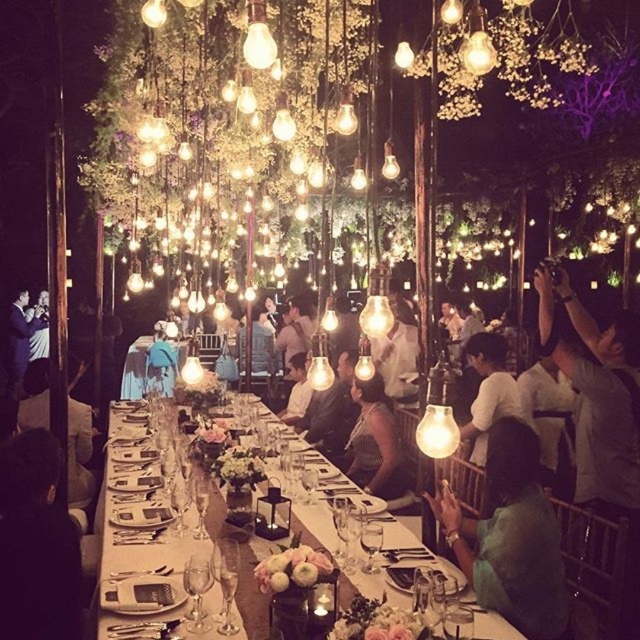
You are a photographer at the event and need to capture a group photo of the guests wearing the white matte shirt at center and the matte white shirt at left. Since you want to ensure both shirts are clearly visible in the photo, which guest should you position closer to the camera to avoid blurring?

The white matte shirt at center has a smaller width than the matte white shirt at left. To ensure both are clearly visible, position the guest wearing the white matte shirt at center closer to the camera since its smaller size might make it harder to capture details from a distance.